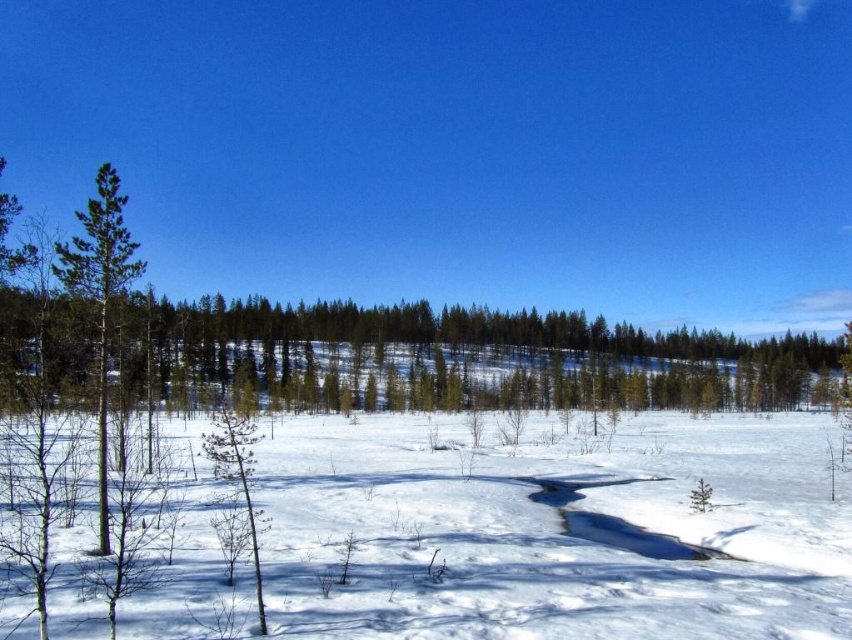
From the picture: You are standing in the winter landscape and want to take a photo of both the green matte tree at left and the green matte tree at lower left. Which tree should you focus on first to ensure both are in the frame?

You should focus on the green matte tree at lower left first because it is positioned lower and closer to the foreground, allowing the green matte tree at left, which is above it, to naturally come into the frame as you adjust your camera angle upward.

You are an explorer in a winter landscape. You see the white powdery snow at center and the green matte tree at lower left. Which object takes up more space in the image?

The green matte tree at lower left takes up more space in the image because the white powdery snow at center is smaller than the green matte tree at lower left.

You are an explorer in a winter landscape and need to determine the safest path. You see the white powdery snow at center. Where exactly is this snow located in the image?

The white powdery snow at center is located at point coordinates of (556,531).